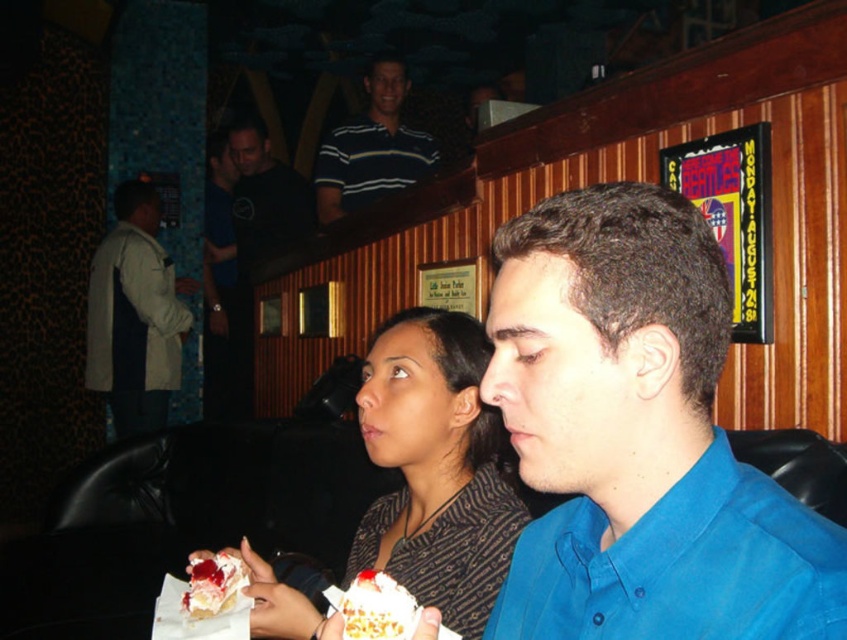
Question: Which of these objects is positioned closest to the black cotton shirt at upper center?

Choices:
 (A) striped polo shirt at upper center
 (B) matte brown dress at center

Answer: (A)

Question: Estimate the real-world distances between objects in this image. Which object is closer to the matte brown dress at center?

Choices:
 (A) striped polo shirt at upper center
 (B) light beige jacket at left
 (C) black cotton shirt at upper center
 (D) white frosted cake at center

Answer: (D)

Question: Does striped polo shirt at upper center appear on the right side of white creamy cake at lower center?

Choices:
 (A) yes
 (B) no

Answer: (A)

Question: Can you confirm if light beige jacket at left is positioned to the right of striped polo shirt at upper center?

Choices:
 (A) no
 (B) yes

Answer: (A)

Question: Based on their relative distances, which object is nearer to the matte brown dress at center?

Choices:
 (A) white frosted cake at center
 (B) blue cotton shirt at center
 (C) white creamy cake at lower center

Answer: (C)

Question: Is blue cotton shirt at center positioned in front of light beige jacket at left?

Choices:
 (A) no
 (B) yes

Answer: (B)